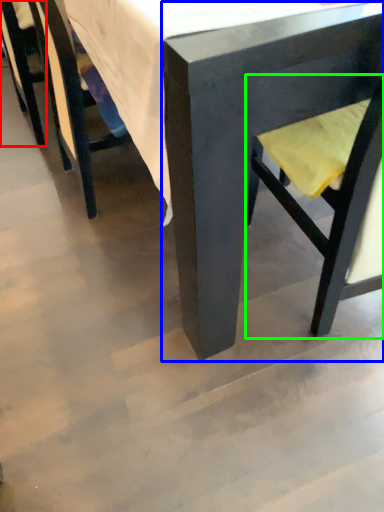
Question: Estimate the real-world distances between objects in this image. Which object is closer to chair (highlighted by a red box), chair (highlighted by a blue box) or swivel chair (highlighted by a green box)?

Choices:
 (A) chair
 (B) swivel chair

Answer: (B)